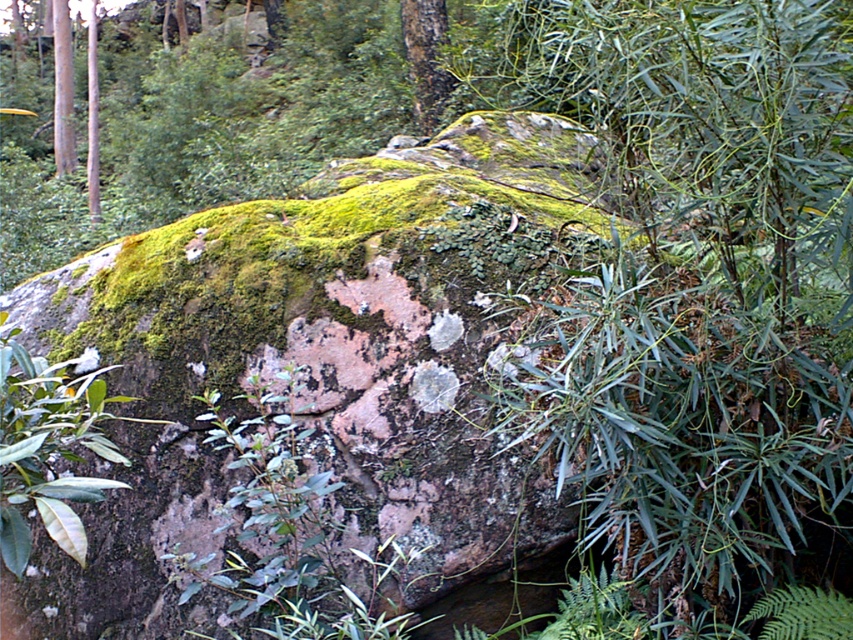
Who is shorter, smooth brown tree trunk at left or smooth brown pole at upper left?

smooth brown pole at upper left is shorter.

In the scene shown: Between smooth brown tree trunk at left and smooth brown pole at upper left, which one appears on the right side from the viewer's perspective?

smooth brown pole at upper left

Locate an element on the screen. The height and width of the screenshot is (640, 853). smooth brown tree trunk at left is located at coordinates (62, 90).

Can you confirm if smooth bark tree at upper center is positioned to the left of smooth brown pole at upper left?

No, smooth bark tree at upper center is not to the left of smooth brown pole at upper left.

Is smooth bark tree at upper center wider than smooth brown pole at upper left?

Yes, smooth bark tree at upper center is wider than smooth brown pole at upper left.

Which is in front, point (415, 20) or point (91, 168)?

Point (415, 20) is more forward.

This screenshot has height=640, width=853. What are the coordinates of `smooth bark tree at upper center` in the screenshot? It's located at (425, 58).

Is point (440, 109) positioned behind point (71, 145)?

No, it is in front of (71, 145).

Who is more distant from viewer, (432,45) or (67,60)?

The point (67,60) is behind.

Describe the element at coordinates (425, 58) in the screenshot. The image size is (853, 640). I see `smooth bark tree at upper center` at that location.

Where is `smooth bark tree at upper center`? The image size is (853, 640). smooth bark tree at upper center is located at coordinates (425, 58).